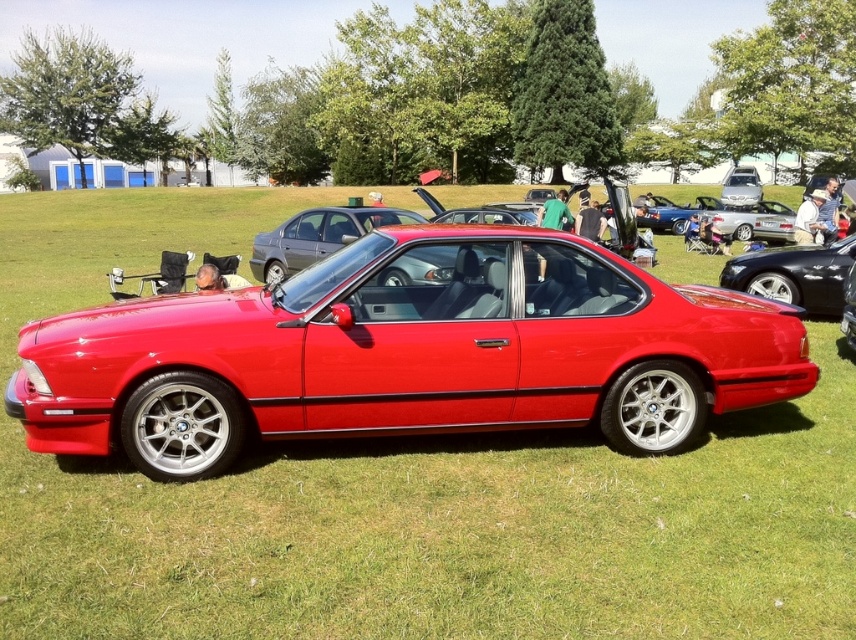
You are standing at the origin point of the coordinate system in the image. You want to walk towards the glossy red car at center. What direction should you head in?

Since the glossy red car at center is located at point (406,353) in the image coordinate system, you should head towards the right and slightly downward from your current position at the origin to reach it.

You are standing at the point with coordinates (406, 353) in the image. What object is located exactly at your current position?

The glossy red car at center is located exactly at the point with coordinates (406, 353).